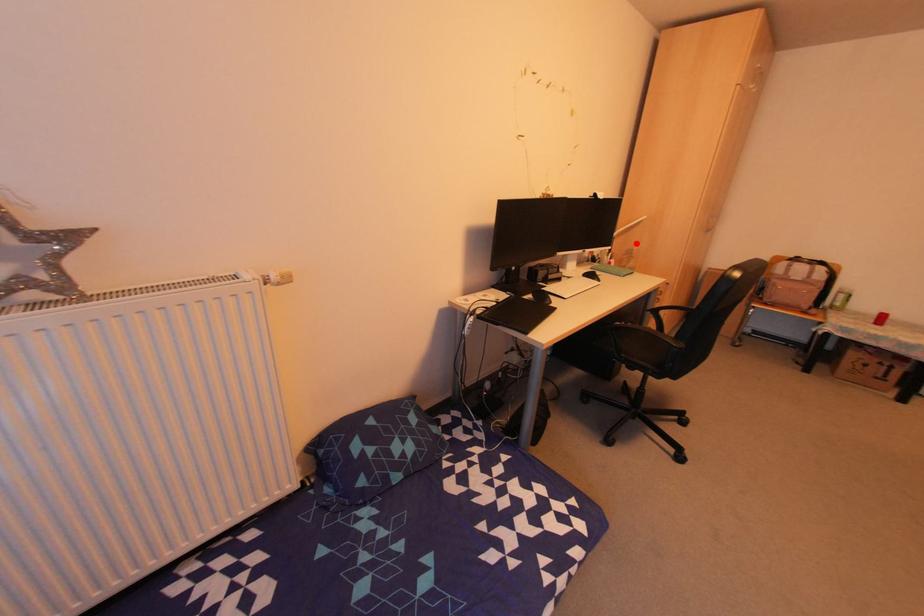
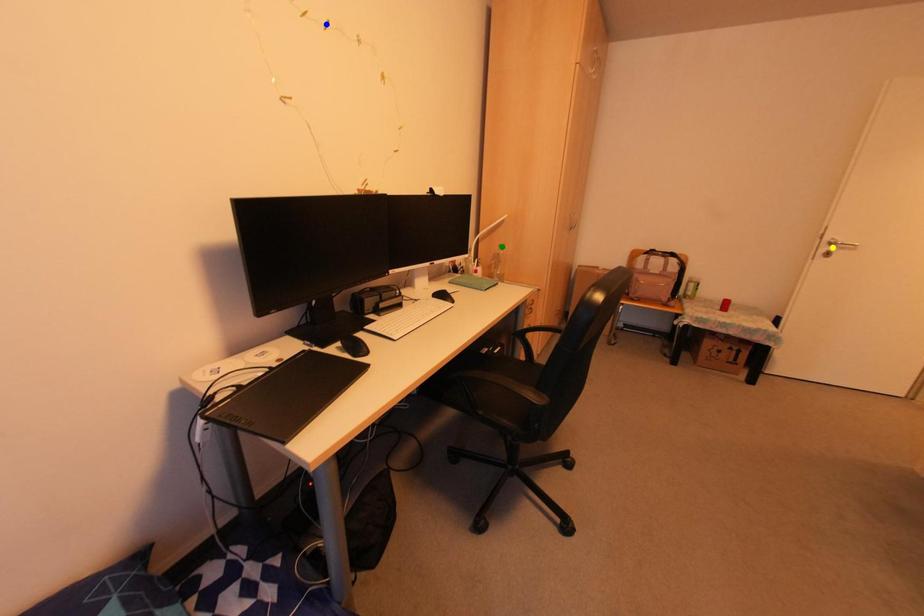
Question: I am providing you with two images of the same scene from different viewpoints. A red point is marked on the first image. You are given multiple points on the second image. Which spot in image 2 lines up with the point in image 1?

Choices:
 (A) blue point
 (B) yellow point
 (C) green point

Answer: (C)